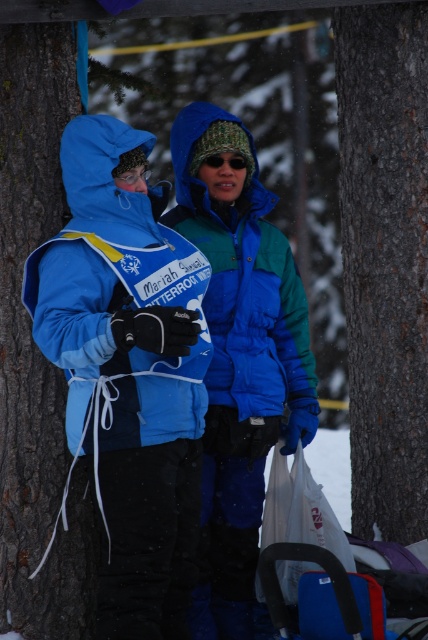
You are trying to decide which item to pack in your bag for a winter hike. The matte blue jacket at center and the brown rough bark at left are both in your sight. Which one is larger in size?

The matte blue jacket at center is bigger than the brown rough bark at left, so you should pack the matte blue jacket at center since it is larger.

You are a nature enthusiast trying to identify different tree barks in the snowy forest. You notice two trees in the image. One has smooth brown bark at center and the other has brown rough bark at left. Which tree has a wider trunk?

The smooth brown bark at center has a wider trunk than the brown rough bark at left since its width is larger.